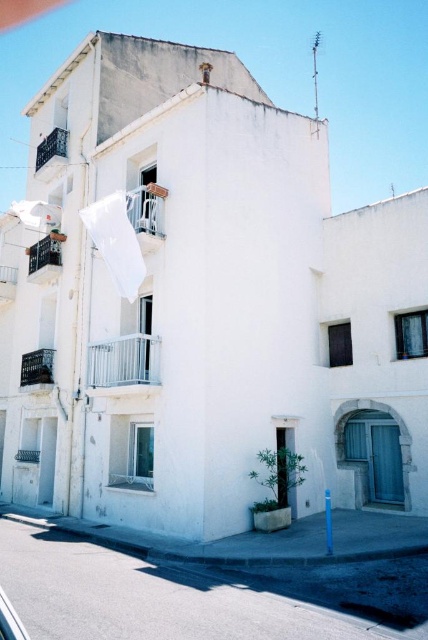
Question: Is white metal balcony at upper left wider than smooth white balcony at lower left?

Choices:
 (A) yes
 (B) no

Answer: (B)

Question: Is smooth white balcony at lower left behind metallic balcony at upper left?

Choices:
 (A) no
 (B) yes

Answer: (A)

Question: Is the position of metallic silver balcony at center less distant than that of white metal balcony at upper left?

Choices:
 (A) no
 (B) yes

Answer: (B)

Question: Among these objects, which one is farthest from the camera?

Choices:
 (A) white metal balcony at upper left
 (B) metallic balcony at left
 (C) metallic balcony at upper left
 (D) smooth white balcony at lower left

Answer: (C)

Question: Which of these objects is positioned closest to the white metal balcony at upper left?

Choices:
 (A) metallic balcony at upper left
 (B) smooth white balcony at lower left

Answer: (B)

Question: Which point appears closest to the camera in this image?

Choices:
 (A) (151, 360)
 (B) (50, 376)
 (C) (128, 195)

Answer: (A)